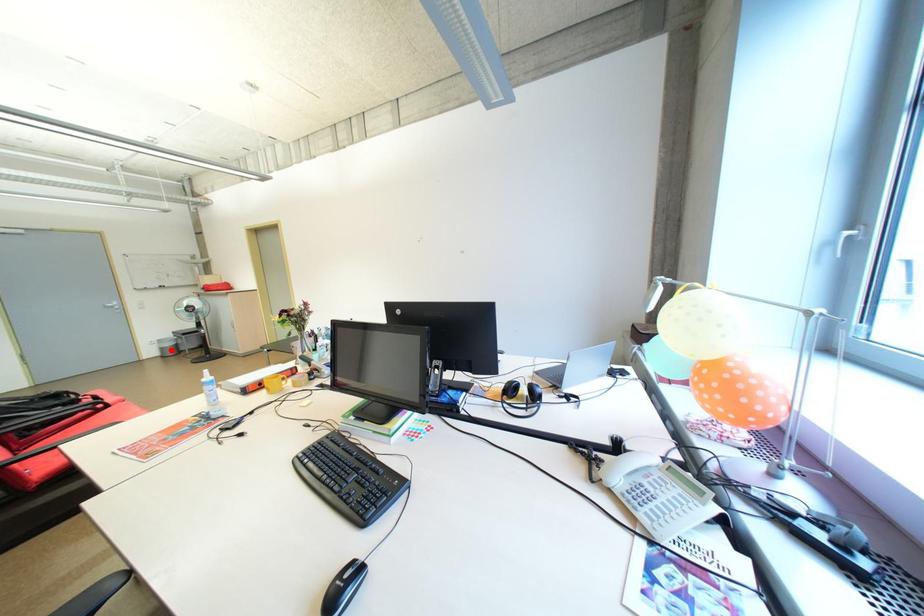
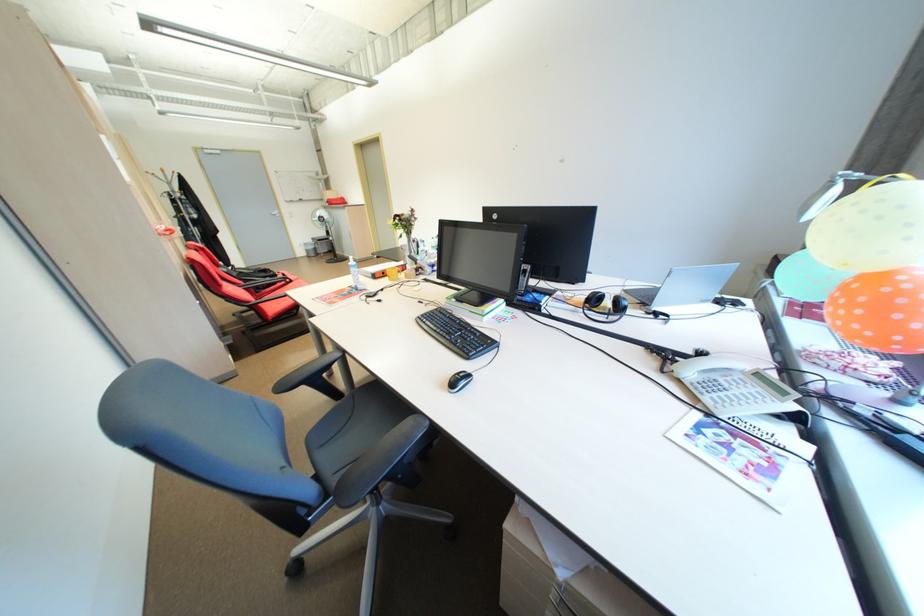
Question: I am providing you with two images of the same scene from different viewpoints. Given a red point in image1, look at the same physical point in image2. Is it:

Choices:
 (A) Closer to the viewpoint
 (B) Farther from the viewpoint

Answer: (A)